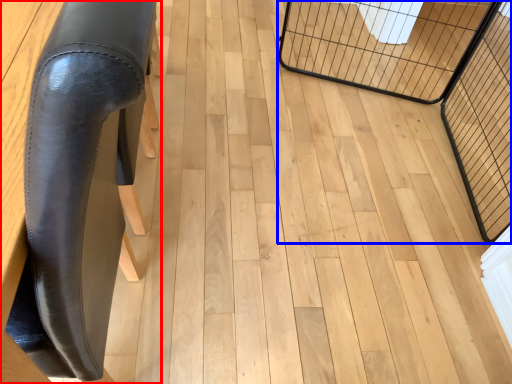
Question: Which object is further to the camera taking this photo, furniture (highlighted by a red box) or cage (highlighted by a blue box)?

Choices:
 (A) furniture
 (B) cage

Answer: (B)